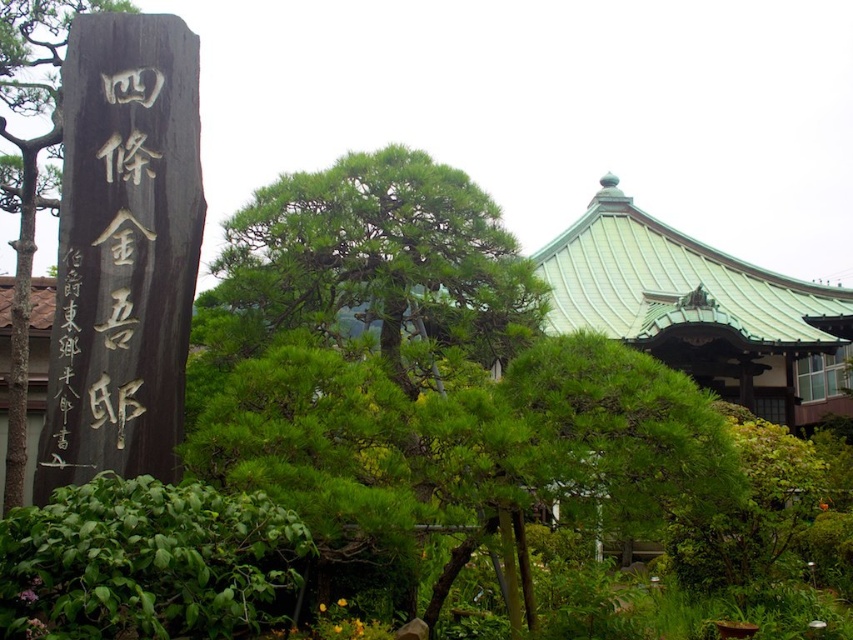
Can you confirm if black wood sign at left is smaller than green leafy tree at left?

Correct, black wood sign at left occupies less space than green leafy tree at left.

Looking at this image, does black wood sign at left have a lesser height compared to green leafy tree at left?

Indeed, black wood sign at left has a lesser height compared to green leafy tree at left.

Where is `black wood sign at left`? This screenshot has height=640, width=853. black wood sign at left is located at coordinates (105, 269).

The height and width of the screenshot is (640, 853). What are the coordinates of `black wood sign at left` in the screenshot? It's located at (105, 269).